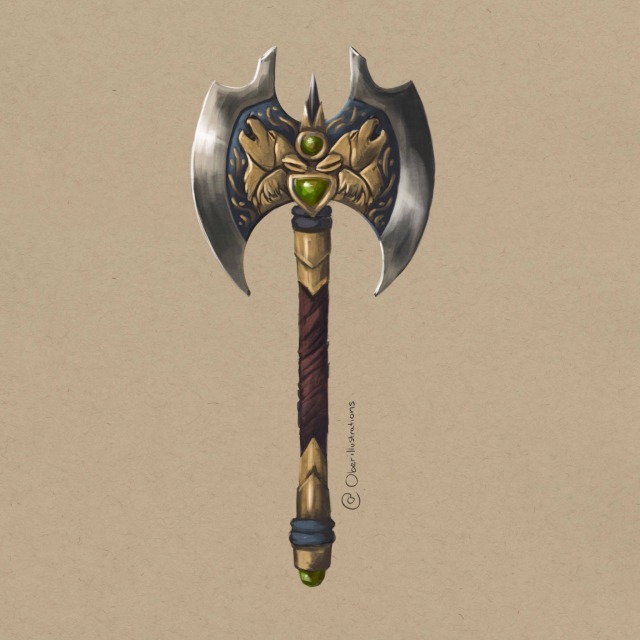
Identify the location of handle. Image resolution: width=640 pixels, height=640 pixels. (310, 444).